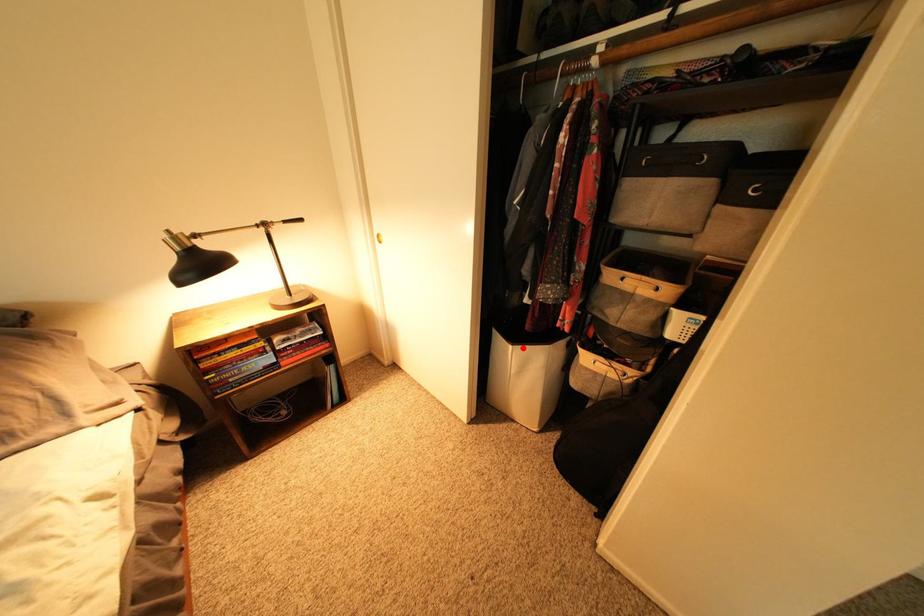
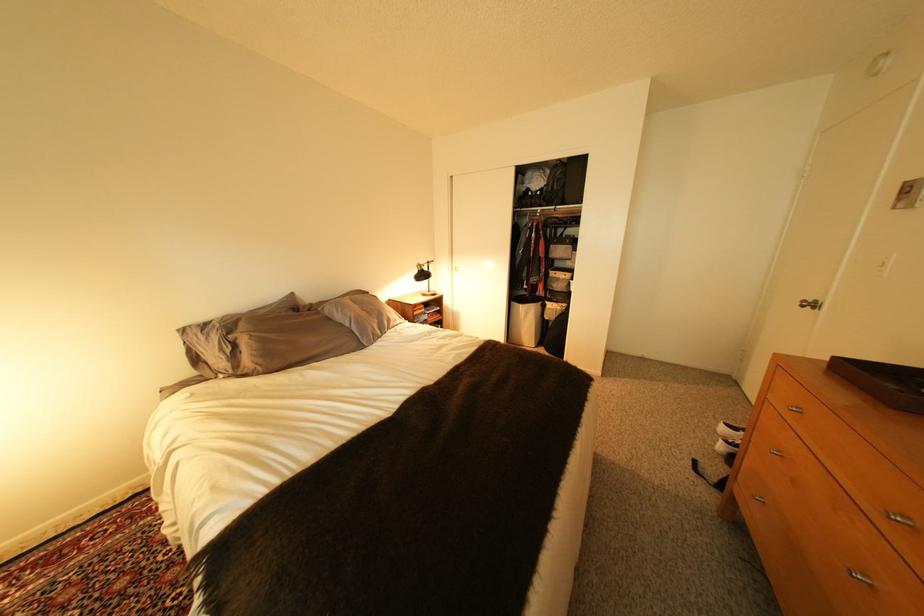
Where in the second image is the point corresponding to the highlighted location from the first image?

(533, 307)